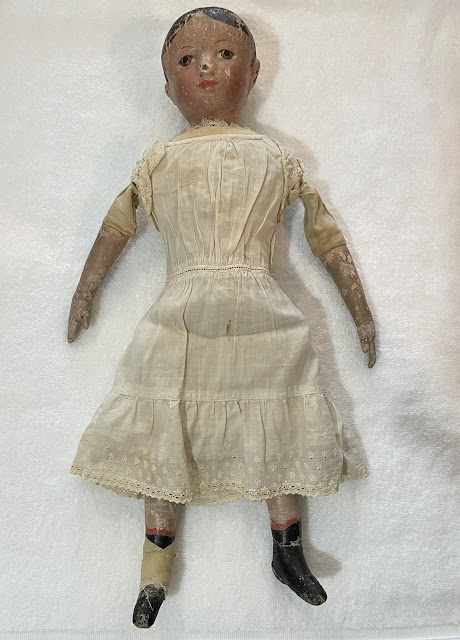
This screenshot has height=640, width=460. What are the coordinates of `doll head` in the screenshot? It's located at (204, 45).